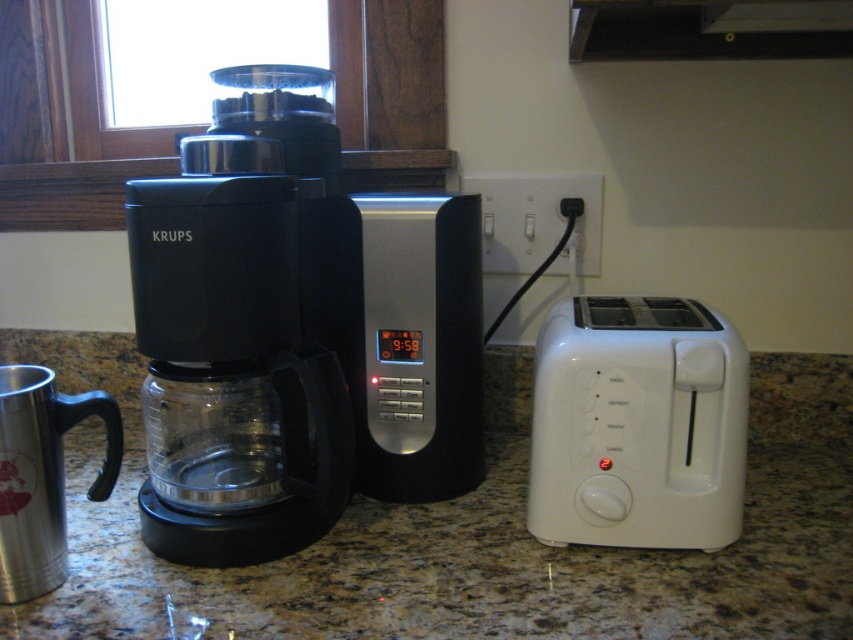
Question: In this image, where is white plastic toaster at right located relative to silver metallic digital clock at center?

Choices:
 (A) above
 (B) below

Answer: (B)

Question: Does white plastic toaster at right have a greater width compared to silver metallic digital clock at center?

Choices:
 (A) yes
 (B) no

Answer: (A)

Question: Is black plastic coffee maker at center to the left of silver metallic digital clock at center from the viewer's perspective?

Choices:
 (A) yes
 (B) no

Answer: (A)

Question: Which point is farther to the camera?

Choices:
 (A) (392, 397)
 (B) (212, 212)
 (C) (113, 548)

Answer: (A)

Question: Considering the real-world distances, which object is farthest from the black plastic coffee maker at center?

Choices:
 (A) white plastic toaster at right
 (B) granite at center
 (C) silver metallic digital clock at center

Answer: (A)

Question: Which of the following is the farthest from the observer?

Choices:
 (A) (90, 474)
 (B) (444, 460)
 (C) (723, 392)
 (D) (318, 212)

Answer: (A)